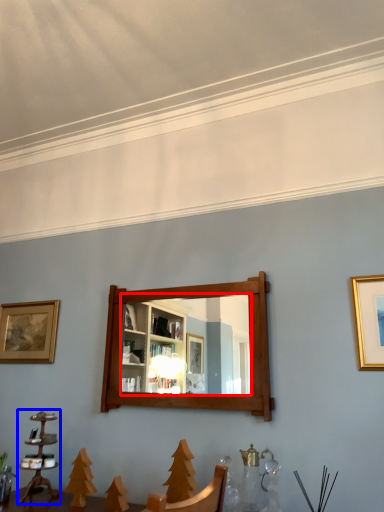
Question: Which object is closer to the camera taking this photo, mirror (highlighted by a red box) or candle holder (highlighted by a blue box)?

Choices:
 (A) mirror
 (B) candle holder

Answer: (A)